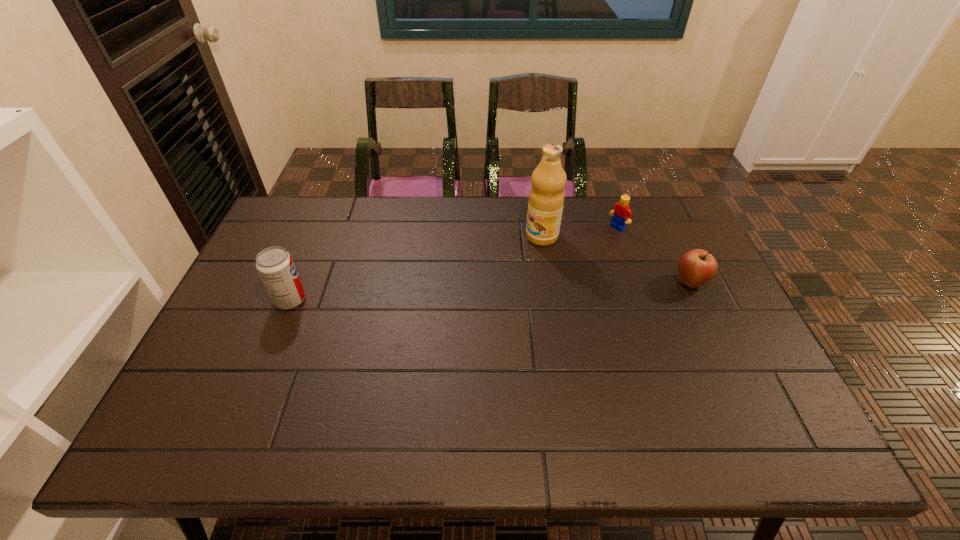
Find the location of a particular element. The height and width of the screenshot is (540, 960). soda is located at coordinates (275, 265).

Locate an element on the screen. This screenshot has height=540, width=960. the leftmost object is located at coordinates (275, 265).

The width and height of the screenshot is (960, 540). I want to click on apple, so click(697, 267).

At what (x,y) coordinates should I click in order to perform the action: click on the third object from left to right. Please return your answer as a coordinate pair (x, y). This screenshot has width=960, height=540. Looking at the image, I should click on (621, 211).

Identify the location of olive oil. The height and width of the screenshot is (540, 960). (546, 198).

This screenshot has height=540, width=960. I want to click on the tallest object, so click(546, 198).

The height and width of the screenshot is (540, 960). I want to click on vacant space situated on the right of the third shortest object, so click(x=331, y=300).

Locate an element on the screen. free space located 0.320m on the front of the apple is located at coordinates (744, 397).

Locate an element on the screen. vacant space located on the front-facing side of the Lego is located at coordinates (554, 269).

You are a GUI agent. You are given a task and a screenshot of the screen. Output one action in this format:
    pyautogui.click(x=<x>, y=<y>)
    Task: Click on the free point located 0.130m on the front-facing side of the Lego
    
    Given the screenshot: What is the action you would take?
    [x=587, y=248]